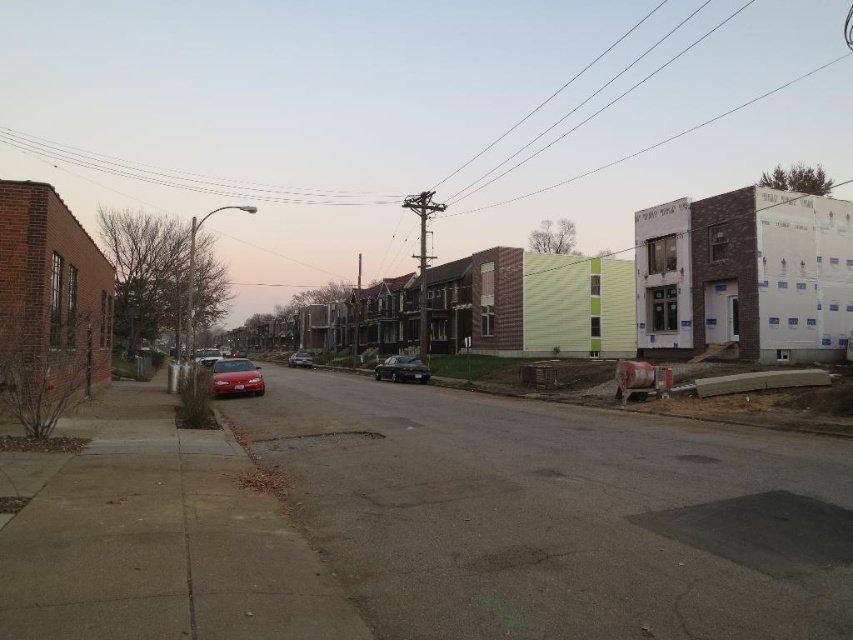
You are standing on the sidewalk and see a point marked at coordinates (x=592, y=97). What object is located at that point?

The point at coordinates (x=592, y=97) marks the location of the smooth wire at upper center.

You are a delivery person trying to navigate through the residential street. There is a smooth wire at upper center and a shiny silver sedan at center. Which object is positioned more to the right side of the street?

The smooth wire at upper center is positioned to the right of the shiny silver sedan at center, so the smooth wire at upper center is more to the right side of the street.